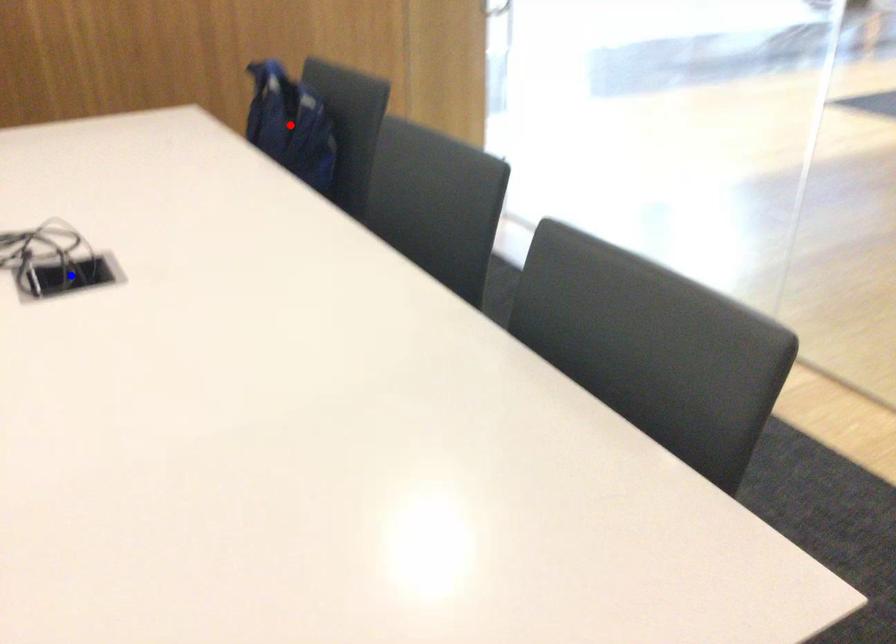
Question: In the image, two points are highlighted. Which point is nearer to the camera? Reply with the corresponding letter.

Choices:
 (A) blue point
 (B) red point

Answer: (A)